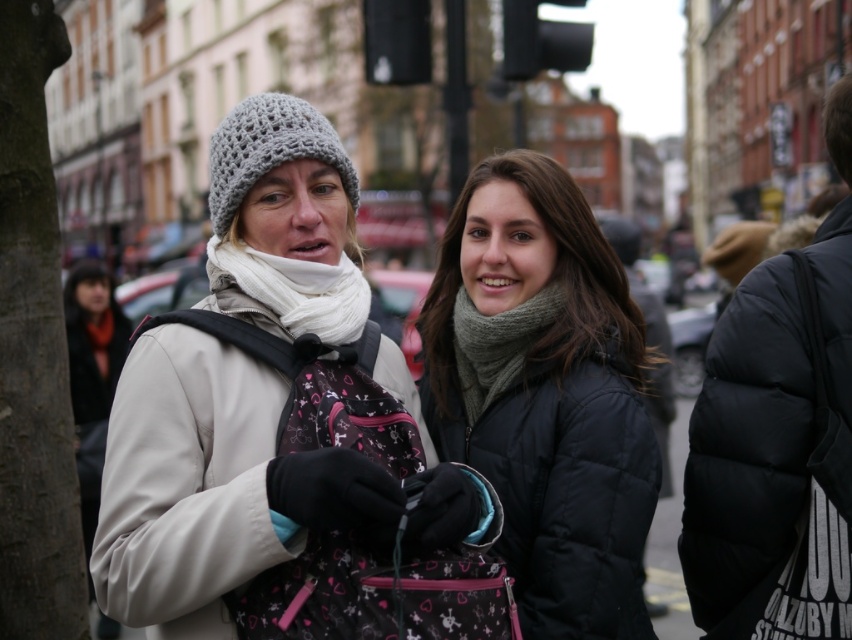
You are a fashion designer observing two jackets displayed at a store. The jackets are the white matte jacket at center and the matte black jacket at center. Based on their sizes, which one do you think would be more suitable for someone who needs a larger jacket for colder weather?

The white matte jacket at center is bigger than the matte black jacket at center, so it would be more suitable for someone needing a larger jacket for colder weather.

You are a fashion designer analyzing this street scene. You notice the matte black jacket at center and the knitted gray scarf at center. Which item is positioned lower on the person?

The matte black jacket at center is located below knitted gray scarf at center, so the matte black jacket at center is positioned lower.